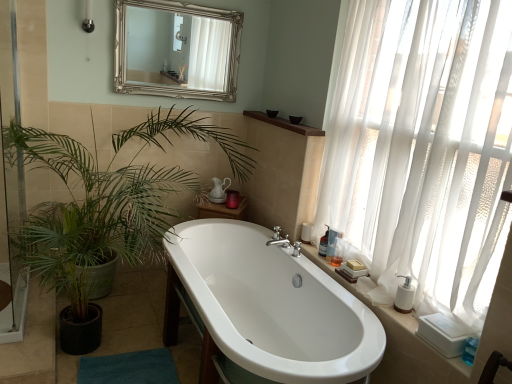
Question: Is silver/gilded mirror at upper center not close to translucent plastic bottle at right, the 1th toiletry positioned from the back?

Choices:
 (A) yes
 (B) no

Answer: (A)

Question: Considering the relative positions of silver/gilded mirror at upper center and translucent plastic bottle at right, which appears as the 3th toiletry when viewed from the front, in the image provided, is silver/gilded mirror at upper center to the left of translucent plastic bottle at right, which appears as the 3th toiletry when viewed from the front, from the viewer's perspective?

Choices:
 (A) no
 (B) yes

Answer: (B)

Question: Considering the relative sizes of silver/gilded mirror at upper center and translucent plastic bottle at right, which appears as the 3th toiletry when viewed from the front, in the image provided, is silver/gilded mirror at upper center smaller than translucent plastic bottle at right, which appears as the 3th toiletry when viewed from the front,?

Choices:
 (A) no
 (B) yes

Answer: (A)

Question: Is silver/gilded mirror at upper center at the right side of translucent plastic bottle at right, which appears as the 3th toiletry when viewed from the front?

Choices:
 (A) yes
 (B) no

Answer: (B)

Question: Would you say silver/gilded mirror at upper center is outside translucent plastic bottle at right, the 1th toiletry positioned from the back?

Choices:
 (A) yes
 (B) no

Answer: (A)

Question: From their relative heights in the image, would you say translucent plastic bottle at right, the 1th toiletry positioned from the front, is taller or shorter than white ceramic counter top at right?

Choices:
 (A) short
 (B) tall

Answer: (B)

Question: From a real-world perspective, is translucent plastic bottle at right, the 1th toiletry positioned from the front, positioned above or below white ceramic counter top at right?

Choices:
 (A) below
 (B) above

Answer: (B)

Question: Considering the positions of translucent plastic bottle at right, arranged as the 3th toiletry when viewed from the back, and white ceramic counter top at right in the image, is translucent plastic bottle at right, arranged as the 3th toiletry when viewed from the back, wider or thinner than white ceramic counter top at right?

Choices:
 (A) wide
 (B) thin

Answer: (B)

Question: Does point (333, 263) appear closer or farther from the camera than point (448, 364)?

Choices:
 (A) closer
 (B) farther

Answer: (B)

Question: Considering the positions of brown wood shelf at upper center and white glossy bathtub at center in the image, is brown wood shelf at upper center bigger or smaller than white glossy bathtub at center?

Choices:
 (A) small
 (B) big

Answer: (A)

Question: In terms of width, does brown wood shelf at upper center look wider or thinner when compared to white glossy bathtub at center?

Choices:
 (A) wide
 (B) thin

Answer: (B)

Question: From the image's perspective, is brown wood shelf at upper center located above or below white glossy bathtub at center?

Choices:
 (A) below
 (B) above

Answer: (B)

Question: Would you say brown wood shelf at upper center is to the left or to the right of white glossy bathtub at center in the picture?

Choices:
 (A) left
 (B) right

Answer: (B)

Question: From the image's perspective, is white glossy bathtub at center positioned above or below transparent glass screen door at left?

Choices:
 (A) below
 (B) above

Answer: (A)

Question: Is white glossy bathtub at center bigger or smaller than transparent glass screen door at left?

Choices:
 (A) small
 (B) big

Answer: (B)